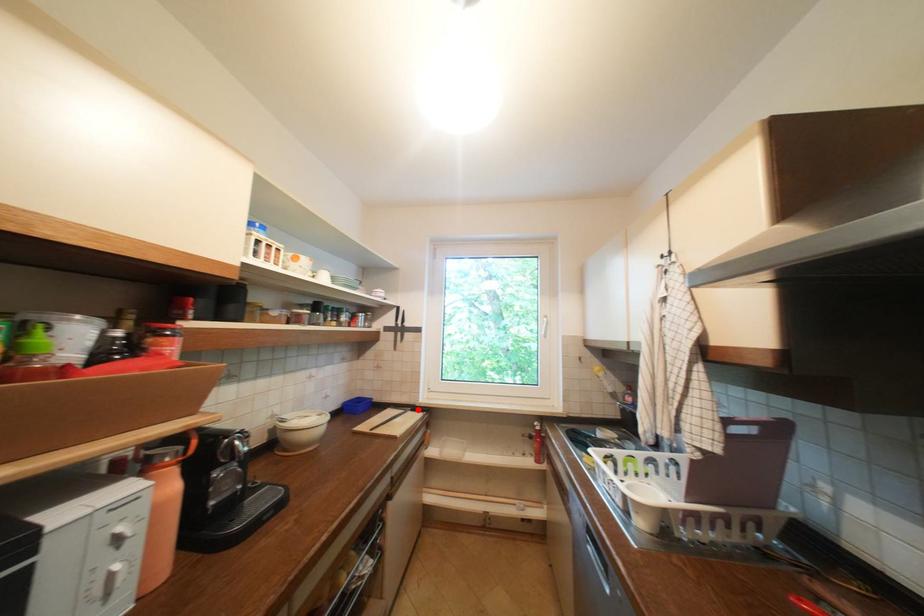
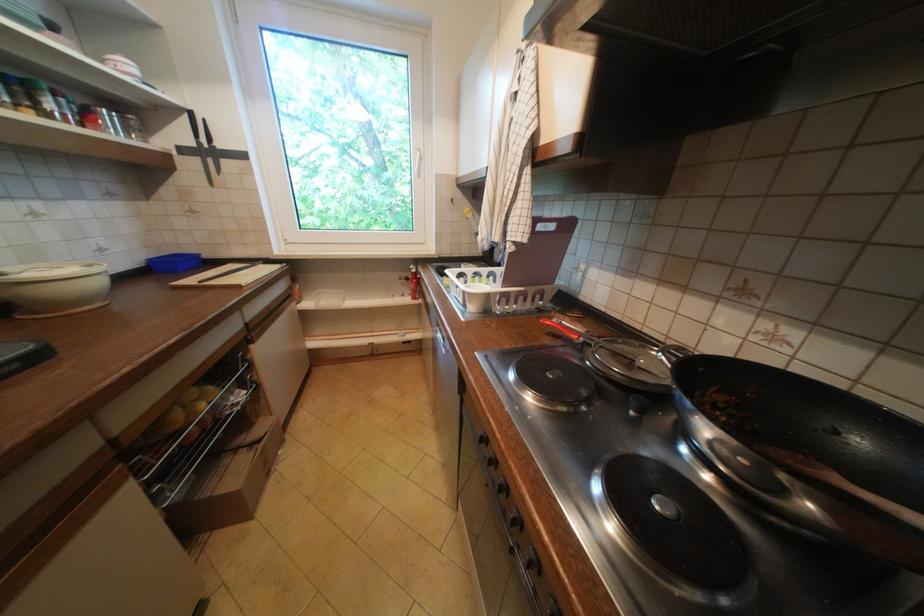
Locate, in the second image, the point that corresponds to the highlighted location in the first image.

(270, 262)